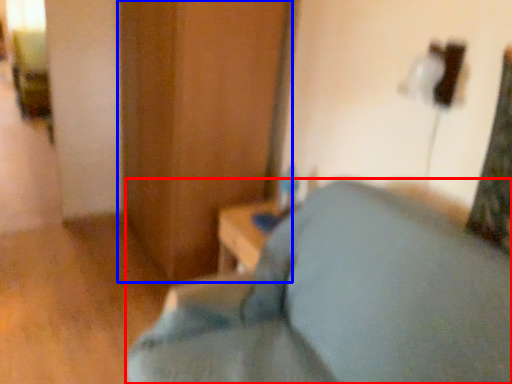
Question: Which point is further to the camera, furniture (highlighted by a red box) or dresser (highlighted by a blue box)?

Choices:
 (A) furniture
 (B) dresser

Answer: (B)